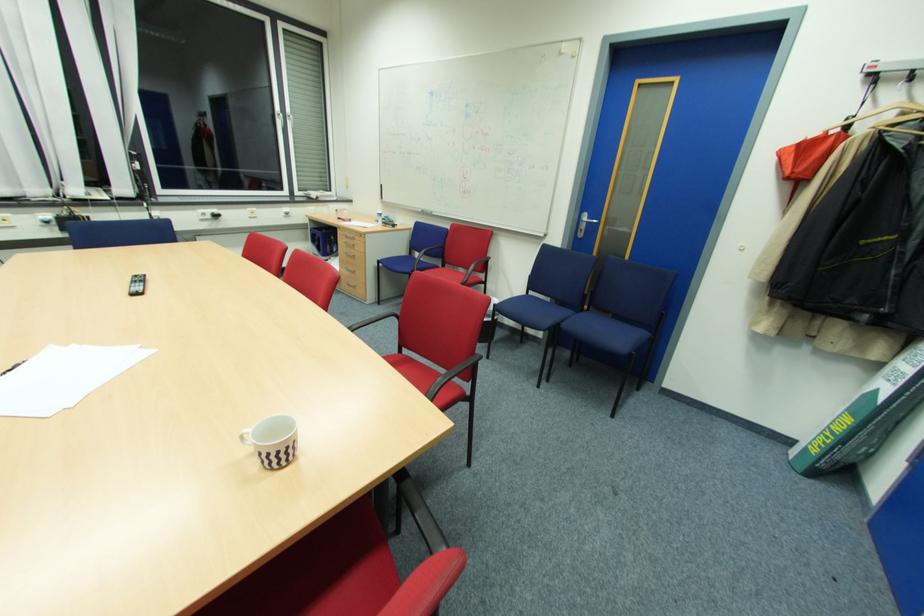
Find the location of a particular element. This screenshot has height=616, width=924. white window handle is located at coordinates (281, 119).